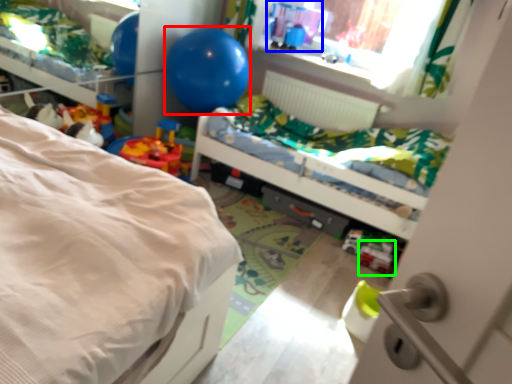
Question: Considering the real-world distances, which object is closest to balloon (highlighted by a red box)? toy (highlighted by a blue box) or toy (highlighted by a green box).

Choices:
 (A) toy
 (B) toy

Answer: (A)